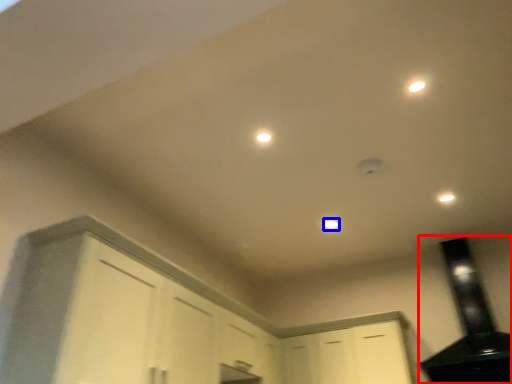
Question: Which object is further to the camera taking this photo, exhaust hood (highlighted by a red box) or dot (highlighted by a blue box)?

Choices:
 (A) exhaust hood
 (B) dot

Answer: (B)